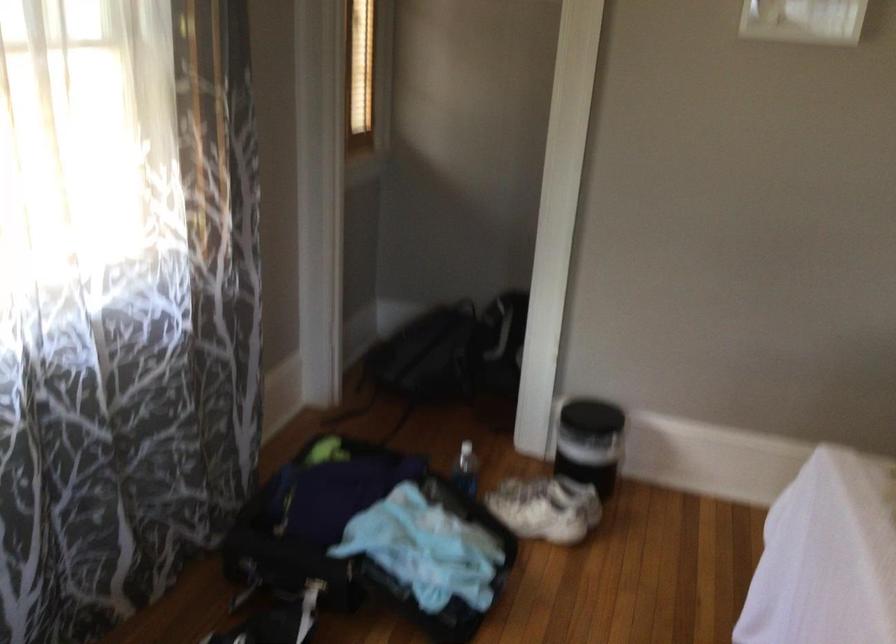
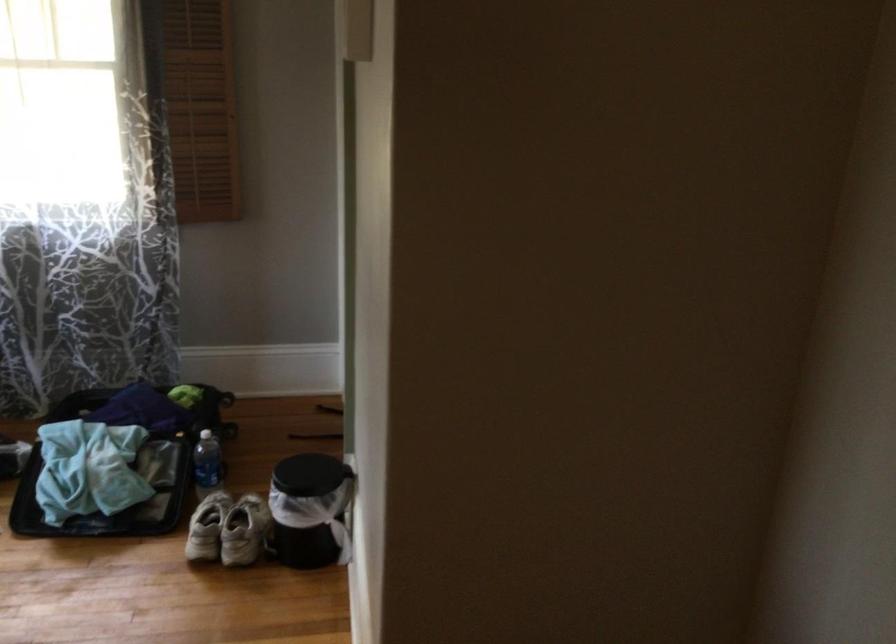
Locate, in the second image, the point that corresponds to the point at 591,487 in the first image.

(244, 531)